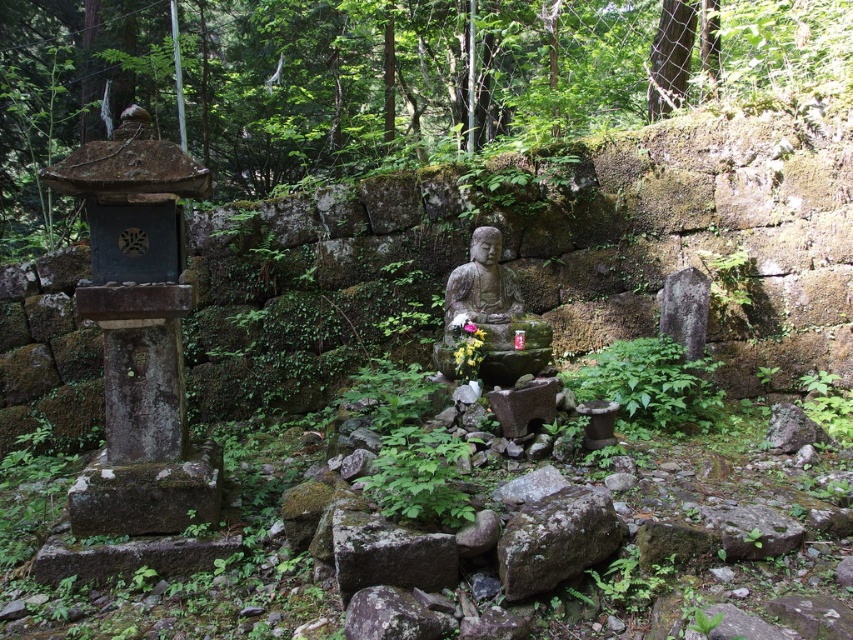
Question: Among these objects, which one is nearest to the camera?

Choices:
 (A) green mossy rock at center
 (B) smooth gray rock at center

Answer: (B)

Question: Which object appears closest to the camera in this image?

Choices:
 (A) gray rough stone at lower right
 (B) stone statue at center
 (C) smooth gray rock at center
 (D) green mossy stone wall at center

Answer: (C)

Question: Which of the following is the farthest from the observer?

Choices:
 (A) (784, 230)
 (B) (473, 336)
 (C) (468, 333)

Answer: (A)

Question: Can you confirm if green mossy stone wall at center is smaller than smooth gray rock at center?

Choices:
 (A) yes
 (B) no

Answer: (B)

Question: Can you confirm if green mossy stone wall at center is bigger than pink matte flower at center?

Choices:
 (A) no
 (B) yes

Answer: (B)

Question: Is green mossy stone wall at center below smooth gray rock at center?

Choices:
 (A) yes
 (B) no

Answer: (B)